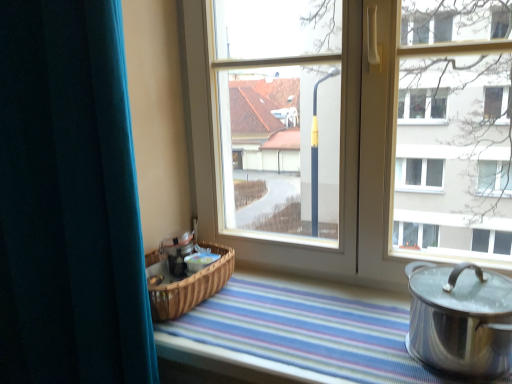
Locate an element on the screen. vacant location below transparent glass window at center (from a real-world perspective) is located at coordinates (320, 284).